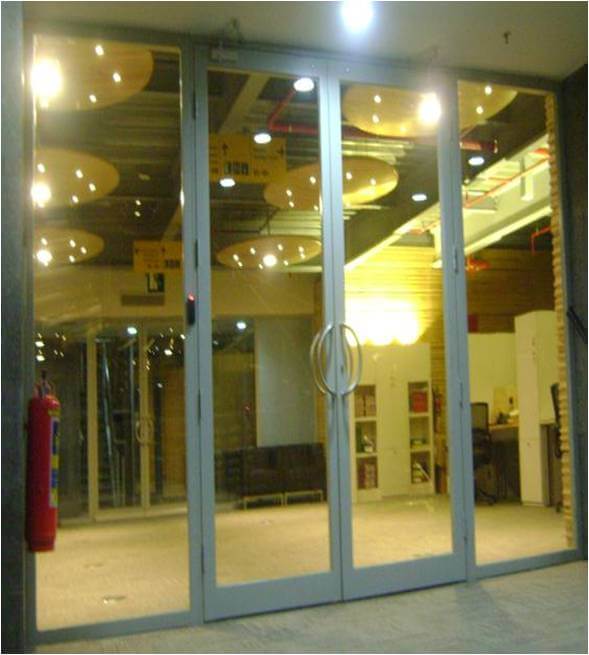
Locate an element on the screen. cushion is located at coordinates (261, 479), (290, 474).